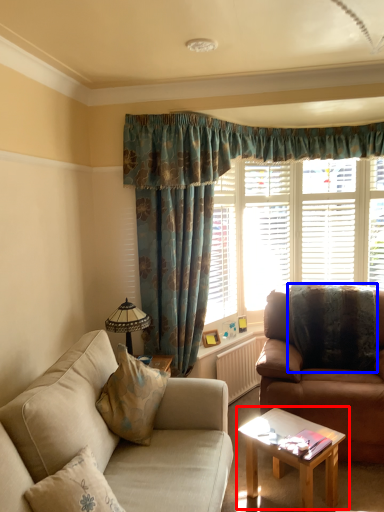
Question: Which object appears closest to the camera in this image, coffee table (highlighted by a red box) or pillow (highlighted by a blue box)?

Choices:
 (A) coffee table
 (B) pillow

Answer: (A)